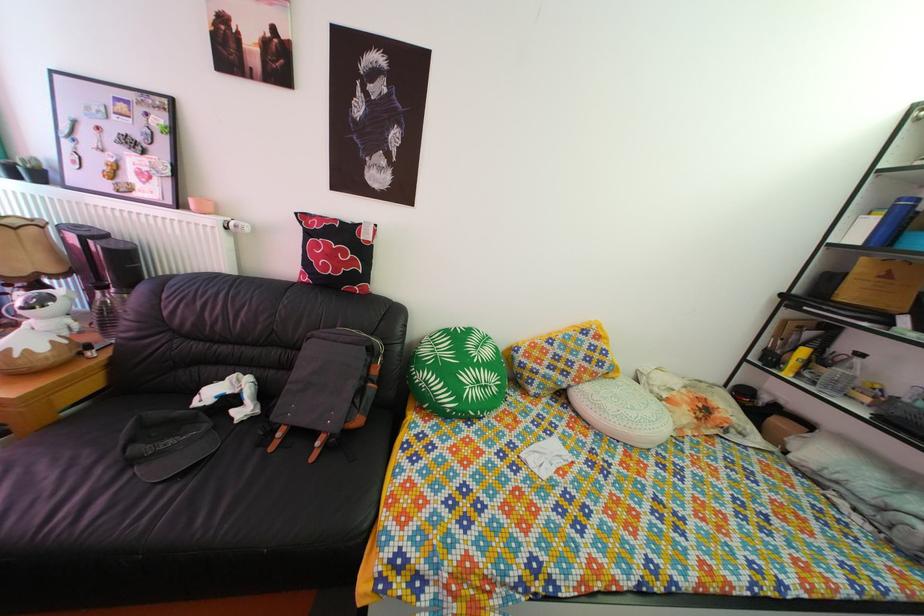
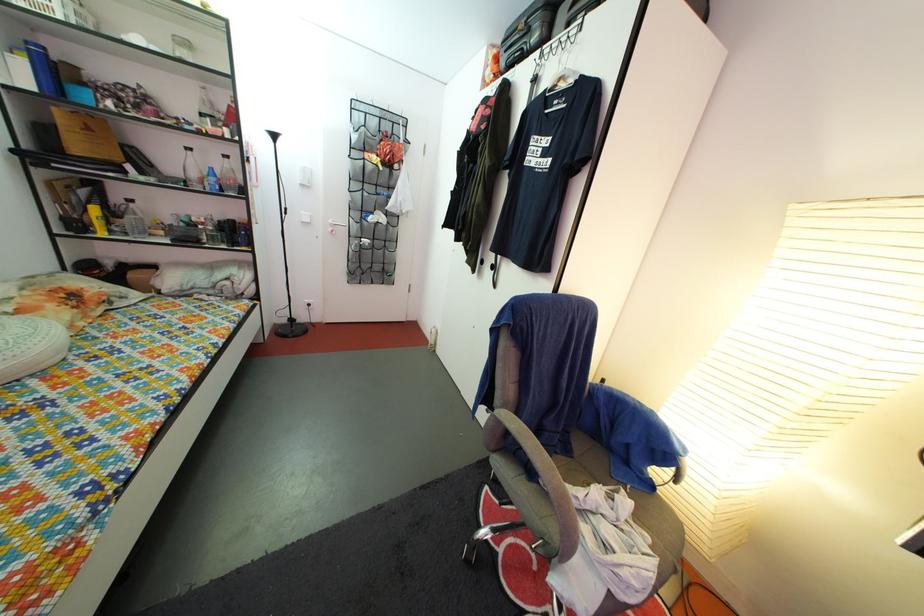
Where in the second image is the point corresponding to [871,267] from the first image?

(64, 118)